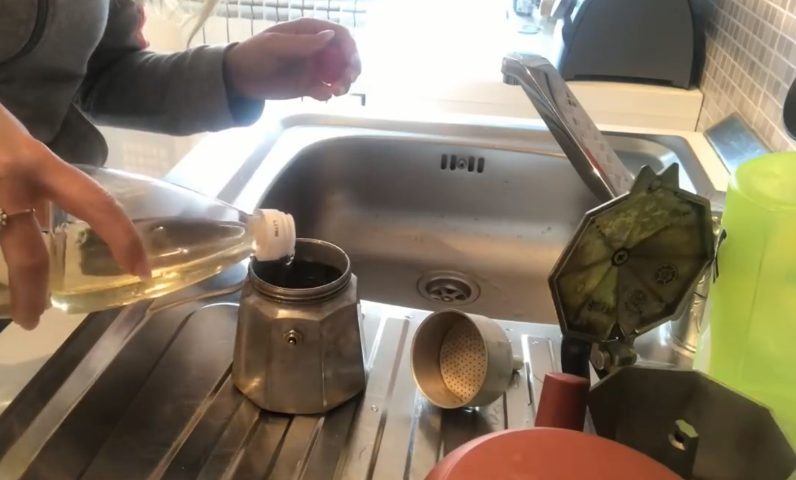
Locate an element on the screen. light gray and white tiled wall is located at coordinates (739, 68).